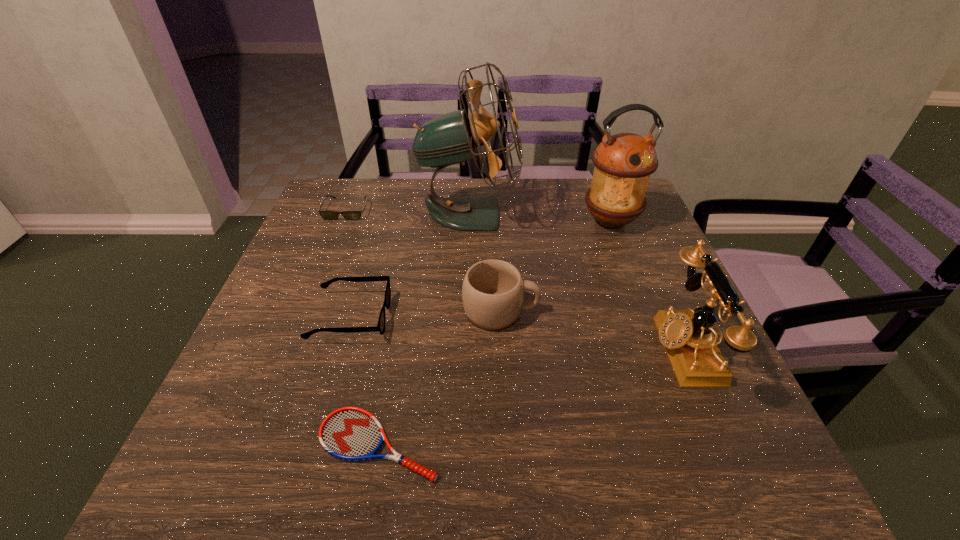
You are a GUI agent. You are given a task and a screenshot of the screen. Output one action in this format:
    pyautogui.click(x=<x>, y=<y>)
    Task: Click on the vacant space situated on the dial of the fifth shortest object
    
    Given the screenshot: What is the action you would take?
    pyautogui.click(x=500, y=348)

Image resolution: width=960 pixels, height=540 pixels. I want to click on free space located 0.260m on the dial of the fifth shortest object, so click(529, 348).

Where is `free space located on the dial of the fifth shortest object`? This screenshot has height=540, width=960. free space located on the dial of the fifth shortest object is located at coordinates (572, 348).

Where is `vacant position located 0.130m on the side of the mug with the handle`? vacant position located 0.130m on the side of the mug with the handle is located at coordinates (597, 311).

What are the coordinates of `vacant space situated on the arms of the third shortest object` in the screenshot? It's located at (451, 318).

You are a GUI agent. You are given a task and a screenshot of the screen. Output one action in this format:
    pyautogui.click(x=<x>, y=<y>)
    Task: Click on the vacant region located 0.080m on the front-facing side of the second shortest object
    
    Given the screenshot: What is the action you would take?
    pyautogui.click(x=335, y=238)

At what (x,y) coordinates should I click in order to perform the action: click on vacant region located 0.370m on the right of the tennis racket. Please return your answer as a coordinate pair (x, y). This screenshot has height=540, width=960. Looking at the image, I should click on (658, 444).

Identify the location of fan that is at the far edge. pos(451,138).

Where is `oil lamp located in the far edge section of the desktop`? oil lamp located in the far edge section of the desktop is located at coordinates (x=624, y=162).

I want to click on sunglasses present at the far edge, so click(x=327, y=215).